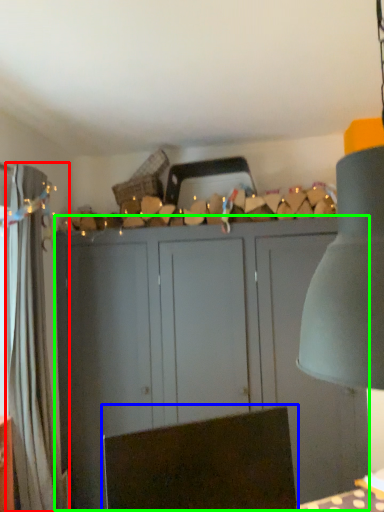
Question: Which is nearer to the curtain (highlighted by a red box)? swivel chair (highlighted by a blue box) or cupboard (highlighted by a green box).

Choices:
 (A) swivel chair
 (B) cupboard

Answer: (B)